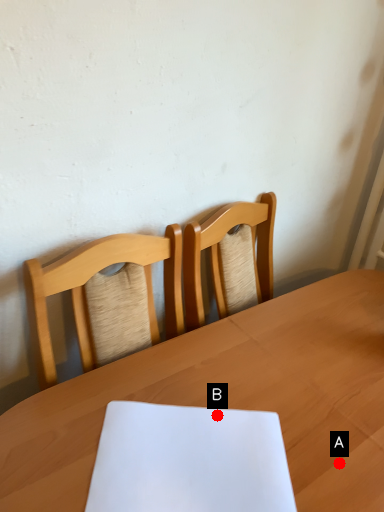
Question: Two points are circled on the image, labeled by A and B beside each circle. Which point is closer to the camera?

Choices:
 (A) A is closer
 (B) B is closer

Answer: (A)